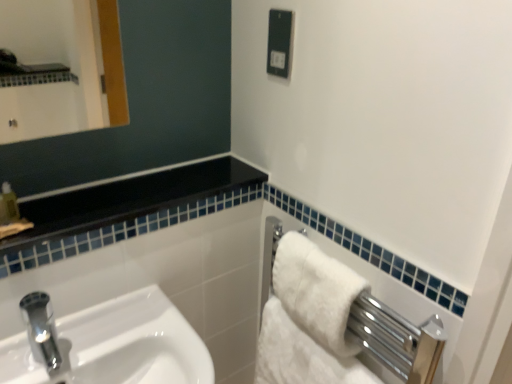
Question: Is black plastic electric outlet at upper center thinner than white fluffy bath towel at right, positioned as the 1th bath towel in bottom-to-top order?

Choices:
 (A) yes
 (B) no

Answer: (A)

Question: Would you say black plastic electric outlet at upper center contains white fluffy bath towel at right, positioned as the 1th bath towel in bottom-to-top order?

Choices:
 (A) no
 (B) yes

Answer: (A)

Question: Can you confirm if black plastic electric outlet at upper center is bigger than white fluffy bath towel at right, positioned as the 1th bath towel in bottom-to-top order?

Choices:
 (A) yes
 (B) no

Answer: (B)

Question: From the image's perspective, would you say black plastic electric outlet at upper center is positioned over white fluffy bath towel at right, the second bath towel viewed from the top?

Choices:
 (A) yes
 (B) no

Answer: (A)

Question: Is black plastic electric outlet at upper center not within white fluffy bath towel at right, positioned as the 1th bath towel in bottom-to-top order?

Choices:
 (A) no
 (B) yes

Answer: (B)

Question: Is black plastic electric outlet at upper center closer to camera compared to white fluffy bath towel at right, the second bath towel viewed from the top?

Choices:
 (A) yes
 (B) no

Answer: (B)

Question: Would you say white fluffy bath towel at right, the 1th bath towel viewed from the top, is a long distance from white fluffy bath towel at right, positioned as the 1th bath towel in bottom-to-top order?

Choices:
 (A) no
 (B) yes

Answer: (A)

Question: Is white fluffy bath towel at right, the 1th bath towel viewed from the top, thinner than white fluffy bath towel at right, the second bath towel viewed from the top?

Choices:
 (A) yes
 (B) no

Answer: (A)

Question: Would you say white fluffy bath towel at right, positioned as the 1th bath towel in bottom-to-top order, is part of white fluffy bath towel at right, which is counted as the 2th bath towel, starting from the bottom,'s contents?

Choices:
 (A) no
 (B) yes

Answer: (A)

Question: Does white fluffy bath towel at right, which is counted as the 2th bath towel, starting from the bottom, have a greater height compared to white fluffy bath towel at right, the second bath towel viewed from the top?

Choices:
 (A) no
 (B) yes

Answer: (A)

Question: Is white fluffy bath towel at right, which is counted as the 2th bath towel, starting from the bottom, smaller than white fluffy bath towel at right, positioned as the 1th bath towel in bottom-to-top order?

Choices:
 (A) no
 (B) yes

Answer: (B)

Question: Is white fluffy bath towel at right, which is counted as the 2th bath towel, starting from the bottom, placed right next to white fluffy bath towel at right, the second bath towel viewed from the top?

Choices:
 (A) yes
 (B) no

Answer: (B)

Question: Is white glossy sink at lower left at the back of black plastic electric outlet at upper center?

Choices:
 (A) yes
 (B) no

Answer: (B)